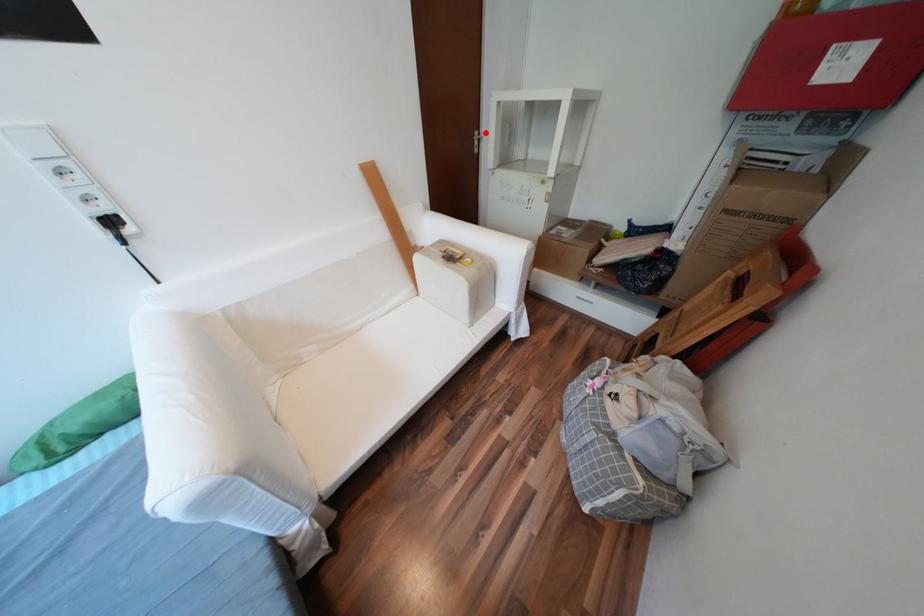
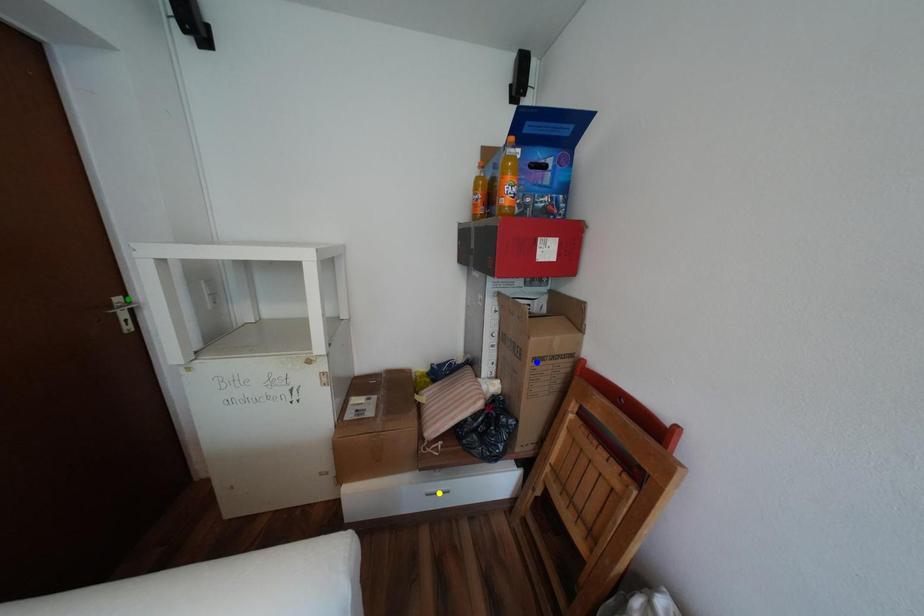
Question: I am providing you with two images of the same scene from different viewpoints. A red point is marked on the first image. You are given multiple points on the second image. Which point in image 2 is actually the same real-world point as the red point in image 1?

Choices:
 (A) green point
 (B) yellow point
 (C) blue point

Answer: (A)